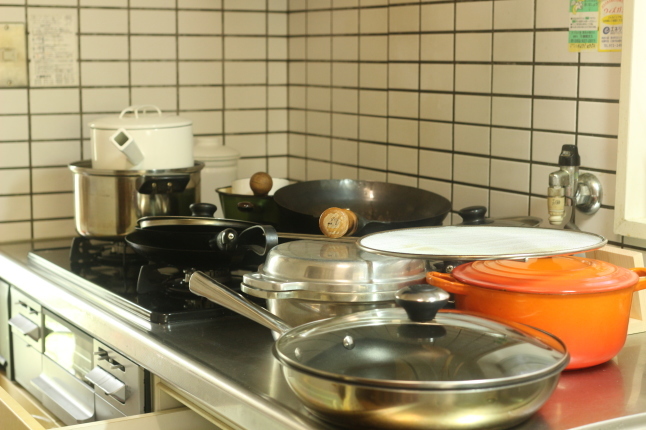
You are a GUI agent. You are given a task and a screenshot of the screen. Output one action in this format:
    pyautogui.click(x=<x>, y=<y>)
    Task: Click on the pots and pans
    
    Given the screenshot: What is the action you would take?
    pyautogui.click(x=422, y=342), pyautogui.click(x=347, y=269), pyautogui.click(x=357, y=206), pyautogui.click(x=156, y=231), pyautogui.click(x=143, y=203), pyautogui.click(x=165, y=144), pyautogui.click(x=247, y=205)